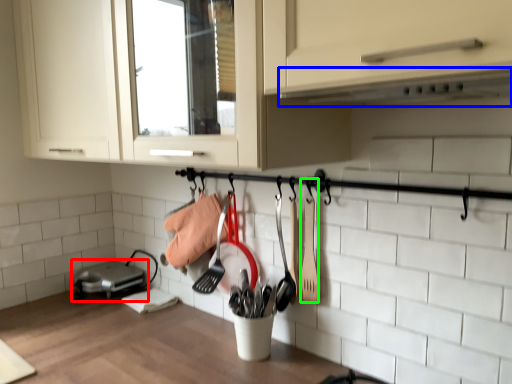
Question: Considering the real-world distances, which object is closest to home appliance (highlighted by a red box)? exhaust hood (highlighted by a blue box) or spatula (highlighted by a green box).

Choices:
 (A) exhaust hood
 (B) spatula

Answer: (B)